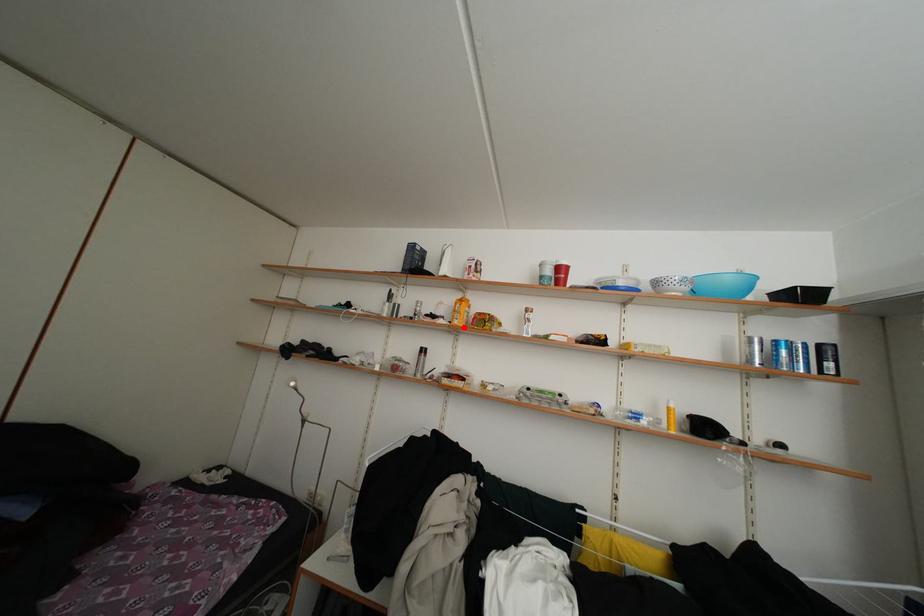
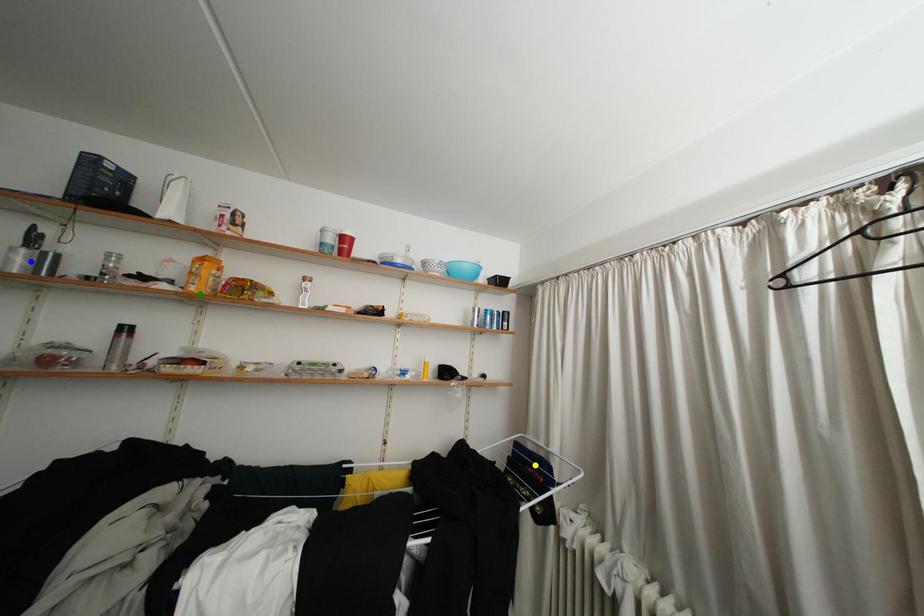
Question: I am providing you with two images of the same scene from different viewpoints. A red point is marked on the first image. You are given multiple points on the second image. Can you choose the point in image 2 that corresponds to the point in image 1?

Choices:
 (A) green point
 (B) blue point
 (C) yellow point

Answer: (A)